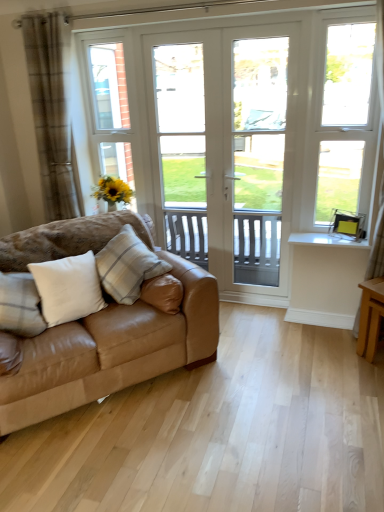
What do you see at coordinates (127, 266) in the screenshot? This screenshot has width=384, height=512. I see `white textured pillow at center, acting as the third pillow starting from the left` at bounding box center [127, 266].

Describe the element at coordinates (68, 288) in the screenshot. The height and width of the screenshot is (512, 384). I see `white soft cushion at left, which is the second pillow in right-to-left order` at that location.

In the scene shown: What is the approximate width of white soft cushion at left, which is the second pillow in right-to-left order?

white soft cushion at left, which is the second pillow in right-to-left order, is 35.64 centimeters wide.

Identify the location of white glossy window sill at lower right. [x=327, y=240].

Measure the distance between point (x=24, y=273) and camera.

A distance of 2.37 meters exists between point (x=24, y=273) and camera.

The image size is (384, 512). What do you see at coordinates (52, 112) in the screenshot?
I see `brown plaid curtain at left` at bounding box center [52, 112].

In order to face tan leather couch at left, should I rotate leftwards or rightwards?

Turn left by 13.252 degrees to look at tan leather couch at left.

I want to click on white textured pillow at center, which appears as the 1th pillow when viewed from the right, so click(127, 266).

Is white plastic window at right wider than white textured pillow at center, which appears as the 1th pillow when viewed from the right?

No, white plastic window at right is not wider than white textured pillow at center, which appears as the 1th pillow when viewed from the right.

Find the location of a particular element. This screenshot has height=512, width=384. pillow that is the 1st object directly below the white plastic window at right (from a real-world perspective) is located at coordinates (127, 266).

Which object is further away from the camera taking this photo, white plastic window at right or white textured pillow at center, which appears as the 1th pillow when viewed from the right?

white plastic window at right is further from the camera.

Could you tell me if white soft cushion at left, acting as the 2th pillow starting from the left, is facing brown plaid curtain at left?

No, white soft cushion at left, acting as the 2th pillow starting from the left, is not facing towards brown plaid curtain at left.

Which is more to the left, white soft cushion at left, acting as the 2th pillow starting from the left, or brown plaid curtain at left?

Positioned to the left is brown plaid curtain at left.

From a real-world perspective, is white soft cushion at left, acting as the 2th pillow starting from the left, below brown plaid curtain at left?

Yes, from a real-world perspective, white soft cushion at left, acting as the 2th pillow starting from the left, is below brown plaid curtain at left.

Looking at this image, from the image's perspective, who appears lower, white soft cushion at left, which is the second pillow in right-to-left order, or white textured pillow at center, which appears as the 1th pillow when viewed from the right?

white soft cushion at left, which is the second pillow in right-to-left order, appears lower in the image.

Is white soft cushion at left, which is the second pillow in right-to-left order, spatially inside white textured pillow at center, acting as the third pillow starting from the left, or outside of it?

white soft cushion at left, which is the second pillow in right-to-left order, is not inside white textured pillow at center, acting as the third pillow starting from the left, it's outside.

Is point (64, 279) in front of point (106, 277)?

Yes.

From the image's perspective, who appears lower, white textured pillow at center, which appears as the 1th pillow when viewed from the right, or white glossy window sill at lower right?

white textured pillow at center, which appears as the 1th pillow when viewed from the right, appears lower in the image.

Is white glossy window sill at lower right located within white textured pillow at center, acting as the third pillow starting from the left?

That's incorrect, white glossy window sill at lower right is not inside white textured pillow at center, acting as the third pillow starting from the left.

Is white textured pillow at center, which appears as the 1th pillow when viewed from the right, to the left or to the right of white glossy window sill at lower right in the image?

white textured pillow at center, which appears as the 1th pillow when viewed from the right, is positioned on white glossy window sill at lower right's left side.

Which of these two, white glossy door at center or brown plaid curtain at left, is thinner?

With smaller width is white glossy door at center.

Is white glossy door at center at the right side of brown plaid curtain at left?

Correct, you'll find white glossy door at center to the right of brown plaid curtain at left.

The width and height of the screenshot is (384, 512). Find the location of `door lying in front of the brown plaid curtain at left`. door lying in front of the brown plaid curtain at left is located at coordinates 226,150.

Consider the image. In the image, is white plastic window at right positioned in front of or behind light brown wood table at lower right?

In the image, white plastic window at right appears behind light brown wood table at lower right.

Is white plastic window at right taller or shorter than light brown wood table at lower right?

In the image, white plastic window at right appears to be taller than light brown wood table at lower right.

Choose the correct answer: Is white plastic window at right inside light brown wood table at lower right or outside it?

white plastic window at right is not inside light brown wood table at lower right, it's outside.

From the image's perspective, is white plastic window at right positioned above or below light brown wood table at lower right?

From the image's perspective, white plastic window at right appears above light brown wood table at lower right.

The width and height of the screenshot is (384, 512). Identify the location of window sill to the right of white soft pillow at lower left, the third pillow viewed from the right. (327, 240).

Is white glossy window sill at lower right located within white soft pillow at lower left, which is the 1th pillow from left to right?

No.

Is point (34, 294) positioned after point (304, 242)?

No.

Considering the positions of objects white soft pillow at lower left, which is the 1th pillow from left to right, and white glossy window sill at lower right in the image provided, who is in front, white soft pillow at lower left, which is the 1th pillow from left to right, or white glossy window sill at lower right?

white soft pillow at lower left, which is the 1th pillow from left to right, is more forward.

Find the location of a particular element. The height and width of the screenshot is (512, 384). the 1st pillow in front when counting from the white plastic window at right is located at coordinates (127, 266).

At what (x,y) coordinates should I click in order to perform the action: click on the 2nd pillow counting from the right side of the brown plaid curtain at left. Please return your answer as a coordinate pair (x, y). Looking at the image, I should click on (68, 288).

Based on their spatial positions, is white soft pillow at lower left, the third pillow viewed from the right, or white plastic window at right further from white textured pillow at center, acting as the third pillow starting from the left?

The object further to white textured pillow at center, acting as the third pillow starting from the left, is white plastic window at right.

Looking at the image, which one is located closer to white glossy window sill at lower right, white soft cushion at left, which is the second pillow in right-to-left order, or white plastic window at right?

Based on the image, white plastic window at right appears to be nearer to white glossy window sill at lower right.

From the picture: Estimate the real-world distances between objects in this image. Which object is closer to brown plaid curtain at left, white soft cushion at left, acting as the 2th pillow starting from the left, or white plastic window at right?

white soft cushion at left, acting as the 2th pillow starting from the left.

Which object lies nearer to the anchor point light brown wood table at lower right, white plastic window at right or white textured pillow at center, acting as the third pillow starting from the left?

white plastic window at right is positioned closer to the anchor light brown wood table at lower right.

Which object lies further to the anchor point white textured pillow at center, acting as the third pillow starting from the left, light brown wood table at lower right or tan leather couch at left?

The object further to white textured pillow at center, acting as the third pillow starting from the left, is light brown wood table at lower right.

Looking at this image, considering their positions, is white glossy door at center positioned closer to light brown wood table at lower right than white plastic window at right?

white plastic window at right lies closer to light brown wood table at lower right than the other object.

Looking at the image, which one is located closer to tan leather couch at left, white glossy door at center or brown plaid curtain at left?

white glossy door at center lies closer to tan leather couch at left than the other object.

Which object lies nearer to the anchor point white glossy window sill at lower right, white soft pillow at lower left, the third pillow viewed from the right, or light brown wood table at lower right?

light brown wood table at lower right lies closer to white glossy window sill at lower right than the other object.

I want to click on pillow between tan leather couch at left and white glossy window sill at lower right from left to right, so click(127, 266).

At what (x,y) coordinates should I click in order to perform the action: click on window sill situated between tan leather couch at left and white plastic window at right from left to right. Please return your answer as a coordinate pair (x, y). This screenshot has width=384, height=512. Looking at the image, I should click on (327, 240).

Find the location of a particular element. This screenshot has width=384, height=512. studio couch located between white soft pillow at lower left, which is the 1th pillow from left to right, and white glossy door at center in the left-right direction is located at coordinates (107, 350).

The image size is (384, 512). I want to click on window sill situated between white soft cushion at left, acting as the 2th pillow starting from the left, and light brown wood table at lower right from left to right, so [x=327, y=240].